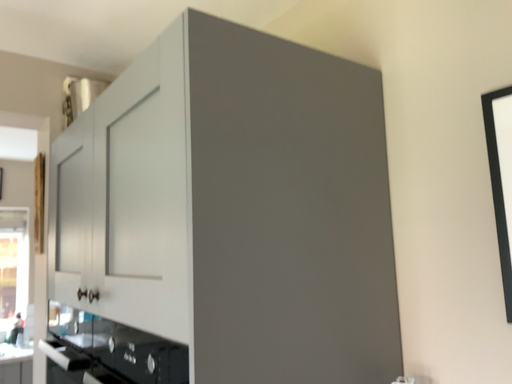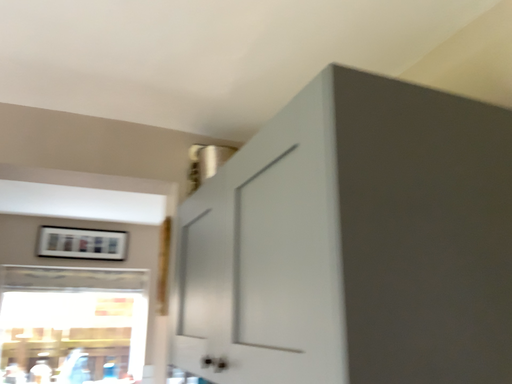
Question: How did the camera likely rotate when shooting the video?

Choices:
 (A) rotated downward
 (B) rotated upward

Answer: (B)